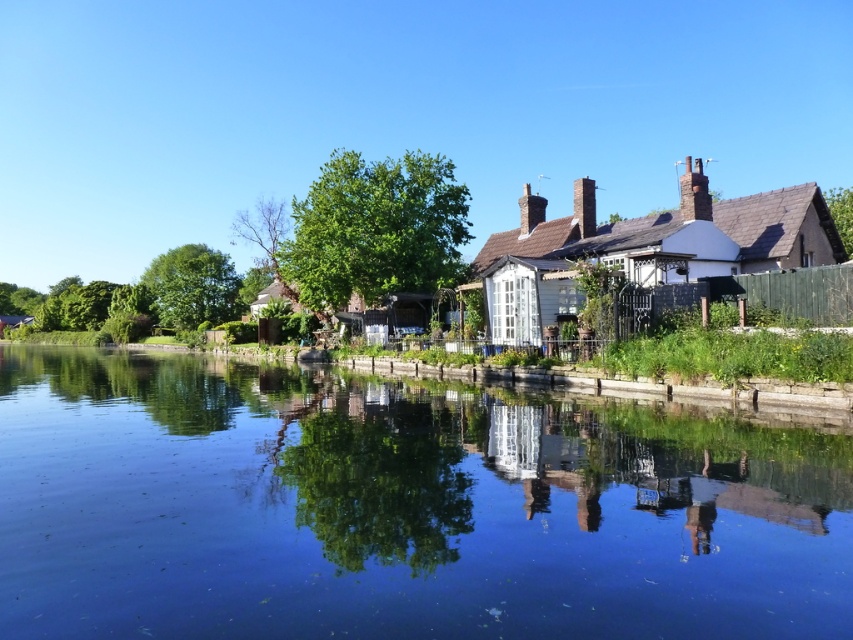
Question: Is green leafy tree at center bigger than green leafy tree at upper right?

Choices:
 (A) yes
 (B) no

Answer: (B)

Question: Which of the following is the farthest from the observer?

Choices:
 (A) green leafy tree at left
 (B) green leafy tree at center
 (C) transparent blue water at center
 (D) green leafy tree at upper right

Answer: (A)

Question: Which object appears closest to the camera in this image?

Choices:
 (A) green leafy tree at left
 (B) green leafy tree at upper right
 (C) green leafy tree at center

Answer: (B)

Question: Where is green leafy tree at center located in relation to green leafy tree at left in the image?

Choices:
 (A) left
 (B) right

Answer: (B)

Question: Among these points, which one is farthest from the camera?

Choices:
 (A) (848, 228)
 (B) (780, 490)
 (C) (178, 273)

Answer: (C)

Question: Does transparent blue water at center have a greater width compared to green leafy tree at left?

Choices:
 (A) yes
 (B) no

Answer: (A)